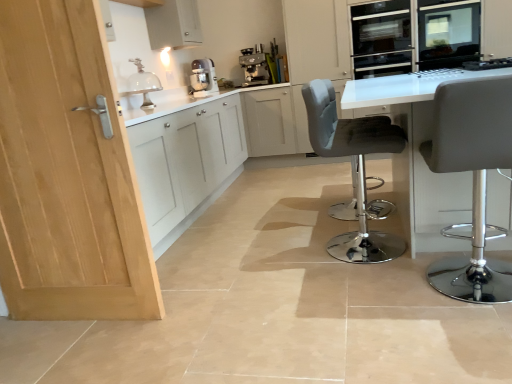
Question: In which direction should I rotate to look at velvet grey bar stool at center, which is counted as the 2th chair, starting from the front?

Choices:
 (A) left
 (B) right

Answer: (B)

Question: Is satin silver oven at upper right shorter than metallic silver coffee machine at upper center?

Choices:
 (A) yes
 (B) no

Answer: (B)

Question: Is satin silver oven at upper right in contact with metallic silver coffee machine at upper center?

Choices:
 (A) yes
 (B) no

Answer: (B)

Question: Is satin silver oven at upper right looking in the opposite direction of metallic silver coffee machine at upper center?

Choices:
 (A) yes
 (B) no

Answer: (B)

Question: Could you tell me if satin silver oven at upper right is turned towards metallic silver coffee machine at upper center?

Choices:
 (A) yes
 (B) no

Answer: (B)

Question: Is the depth of satin silver oven at upper right greater than that of metallic silver coffee machine at upper center?

Choices:
 (A) yes
 (B) no

Answer: (B)

Question: From a real-world perspective, is satin silver oven at upper right positioned under metallic silver coffee machine at upper center based on gravity?

Choices:
 (A) no
 (B) yes

Answer: (A)

Question: Is velvet grey bar stool at center, marked as the first chair in a back-to-front arrangement, at the right side of light wood door at left?

Choices:
 (A) yes
 (B) no

Answer: (A)

Question: Does velvet grey bar stool at center, marked as the first chair in a back-to-front arrangement, have a greater width compared to light wood door at left?

Choices:
 (A) yes
 (B) no

Answer: (A)

Question: Is velvet grey bar stool at center, marked as the first chair in a back-to-front arrangement, aimed at light wood door at left?

Choices:
 (A) no
 (B) yes

Answer: (A)

Question: Can you confirm if velvet grey bar stool at center, which is counted as the 2th chair, starting from the front, is bigger than light wood door at left?

Choices:
 (A) yes
 (B) no

Answer: (A)

Question: Is velvet grey bar stool at center, which is counted as the 2th chair, starting from the front, not close to light wood door at left?

Choices:
 (A) yes
 (B) no

Answer: (A)

Question: Is velvet grey bar stool at center, marked as the first chair in a back-to-front arrangement, to the left of light wood door at left from the viewer's perspective?

Choices:
 (A) no
 (B) yes

Answer: (A)

Question: Is satin silver oven at upper right aimed at matte gray stool at right, the 2th chair when ordered from back to front?

Choices:
 (A) yes
 (B) no

Answer: (A)